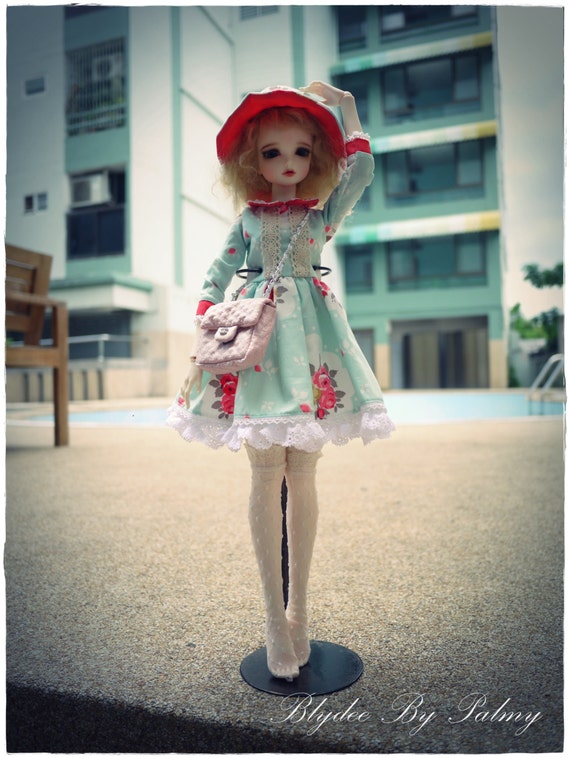
Locate an element on the screen. This screenshot has height=758, width=570. doll stand is located at coordinates (324, 674).